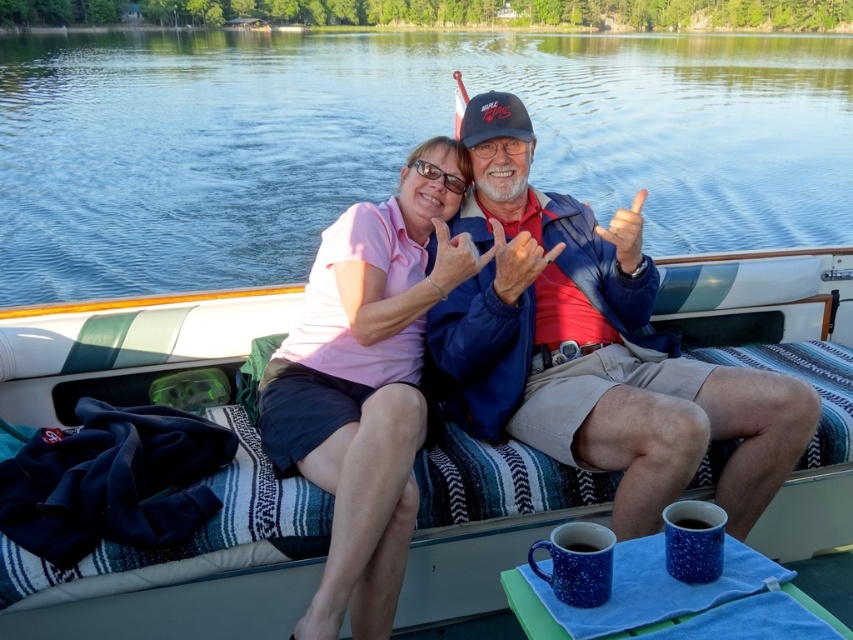
Question: Is blue water at center wider than matte pink shirt at upper center?

Choices:
 (A) yes
 (B) no

Answer: (A)

Question: Is white striped fabric boat at center above matte red hand at center?

Choices:
 (A) yes
 (B) no

Answer: (B)

Question: Estimate the real-world distances between objects in this image. Which object is closer to the white striped fabric boat at center?

Choices:
 (A) pink fabric shirt at center
 (B) blue water at center
 (C) matte red hand at center
 (D) matte pink shirt at upper center

Answer: (A)

Question: Does blue leather jacket at center appear over matte blue finger at center?

Choices:
 (A) yes
 (B) no

Answer: (B)

Question: Which object appears closest to the camera in this image?

Choices:
 (A) matte blue finger at center
 (B) white striped fabric boat at center
 (C) blue leather jacket at center

Answer: (B)

Question: Which point appears farthest from the camera in this image?

Choices:
 (A) (619, 244)
 (B) (683, 83)
 (C) (10, 352)

Answer: (B)